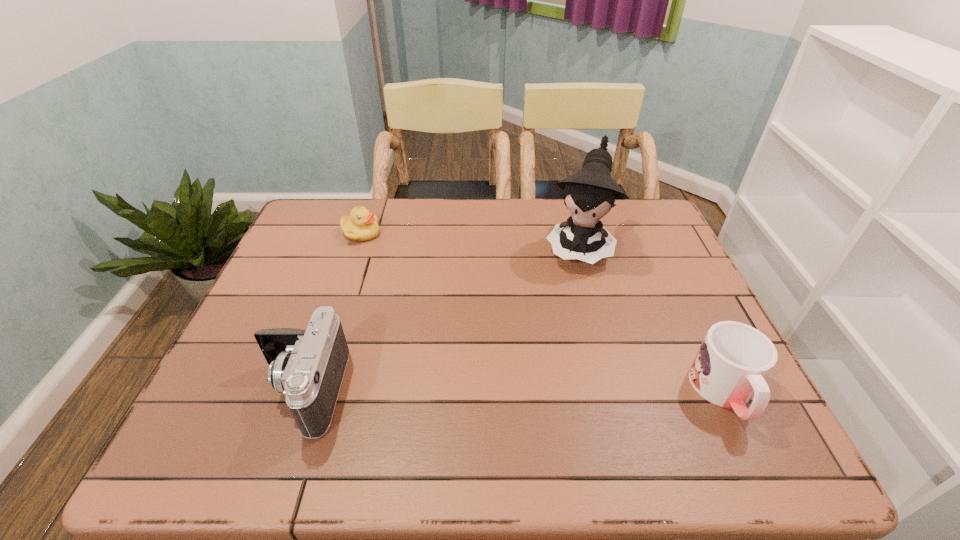
The width and height of the screenshot is (960, 540). Identify the location of vacant area that lies between the second shortest object and the tallest object. (651, 320).

Locate an element on the screen. The height and width of the screenshot is (540, 960). free space between the shortest object and the doll is located at coordinates (469, 240).

Where is `free spot between the second tallest object and the mug`? free spot between the second tallest object and the mug is located at coordinates (513, 392).

I want to click on free space between the third tallest object and the duckling, so click(x=542, y=313).

Locate an element on the screen. free spot between the duckling and the rightmost object is located at coordinates (542, 313).

Find the location of a particular element. Image resolution: width=960 pixels, height=540 pixels. vacant area between the mug and the camera is located at coordinates (513, 392).

The image size is (960, 540). I want to click on unoccupied position between the rightmost object and the duckling, so click(542, 313).

Find the location of a particular element. The width and height of the screenshot is (960, 540). empty location between the second object from right to left and the mug is located at coordinates (651, 320).

Where is `empty location between the second shortest object and the second tallest object`? empty location between the second shortest object and the second tallest object is located at coordinates (513, 392).

Identify which object is the third nearest to the shortest object. Please provide its 2D coordinates. Your answer should be formatted as a tuple, i.e. [(x, y)], where the tuple contains the x and y coordinates of a point satisfying the conditions above.

[(733, 360)]